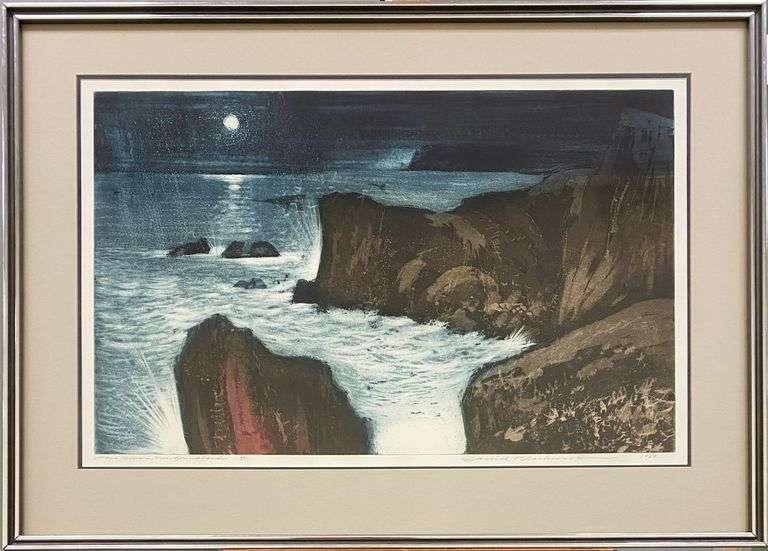
Identify the location of painting. click(x=498, y=355).